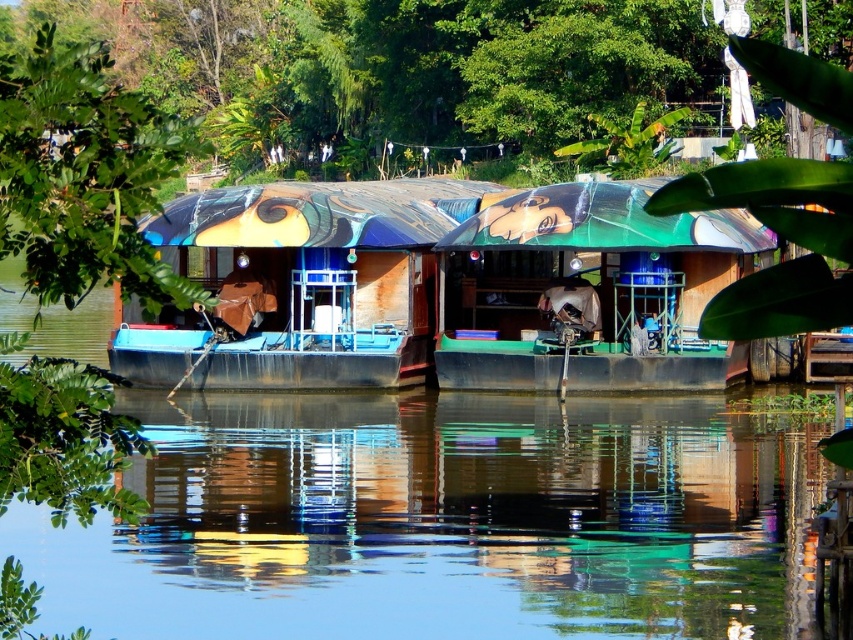
Question: Which object is positioned farthest from the matte blue boat at center?

Choices:
 (A) transparent water at center
 (B) green matte boat at center

Answer: (A)

Question: Which of these objects is positioned farthest from the matte blue boat at center?

Choices:
 (A) transparent water at center
 (B) green matte boat at center

Answer: (A)

Question: Is transparent water at center below matte blue boat at center?

Choices:
 (A) yes
 (B) no

Answer: (A)

Question: Which of the following is the farthest from the observer?

Choices:
 (A) green matte boat at center
 (B) transparent water at center
 (C) matte blue boat at center

Answer: (C)

Question: Does transparent water at center have a lesser width compared to matte blue boat at center?

Choices:
 (A) yes
 (B) no

Answer: (B)

Question: Is transparent water at center wider than green matte boat at center?

Choices:
 (A) no
 (B) yes

Answer: (B)